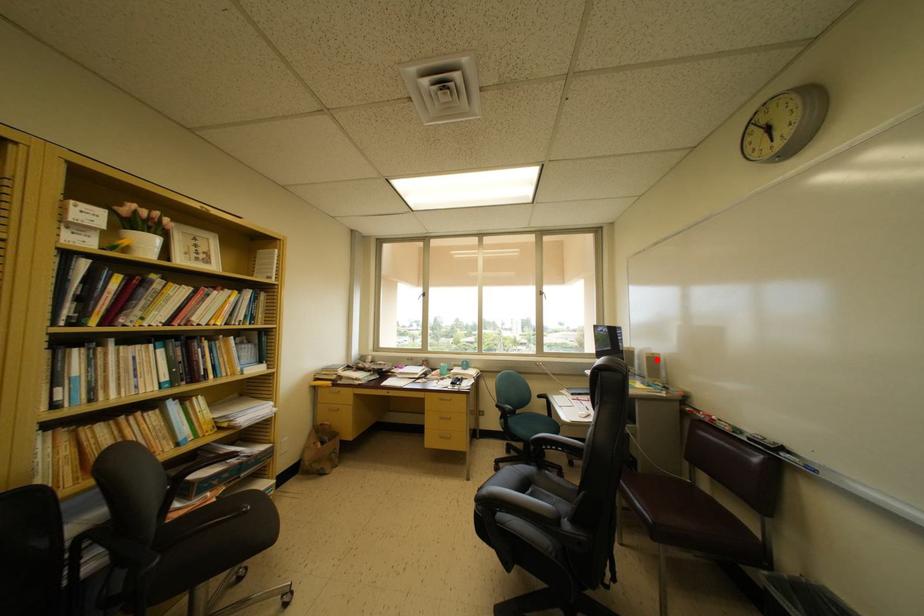
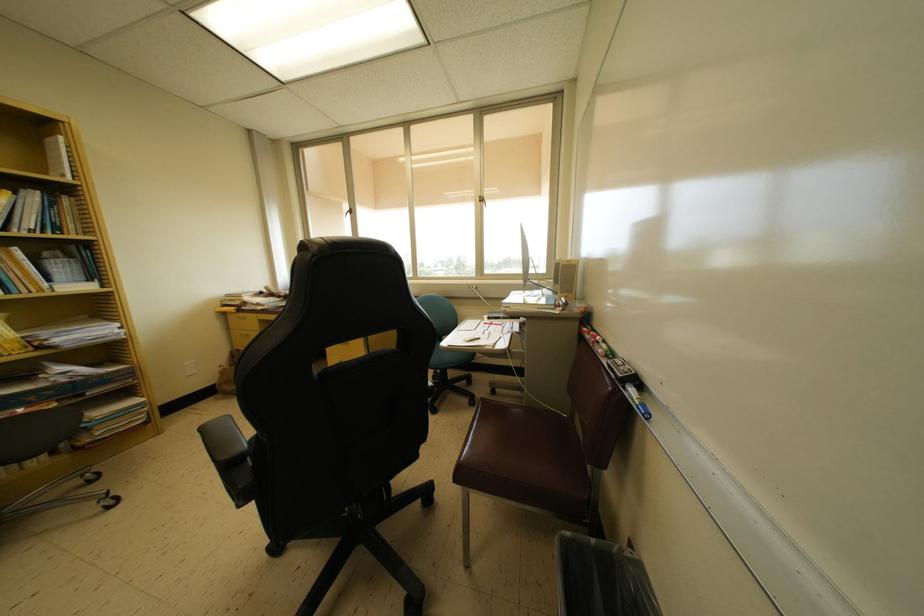
The point at the highlighted location is marked in the first image. Where is the corresponding point in the second image?

(572, 265)